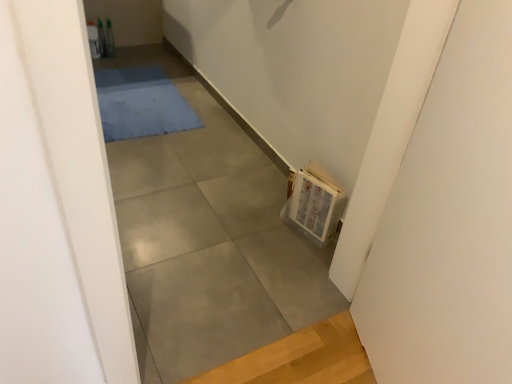
Question: Is blue soft rug at upper center to the left or to the right of wooden frame at right in the image?

Choices:
 (A) right
 (B) left

Answer: (B)

Question: Considering the positions of point (125, 94) and point (336, 188), is point (125, 94) closer or farther from the camera than point (336, 188)?

Choices:
 (A) farther
 (B) closer

Answer: (A)

Question: Based on their relative distances, which object is farther from the wooden frame at right?

Choices:
 (A) gray concrete at center
 (B) blue soft rug at upper center

Answer: (B)

Question: Which object is positioned closest to the wooden frame at right?

Choices:
 (A) gray concrete at center
 (B) blue soft rug at upper center

Answer: (A)